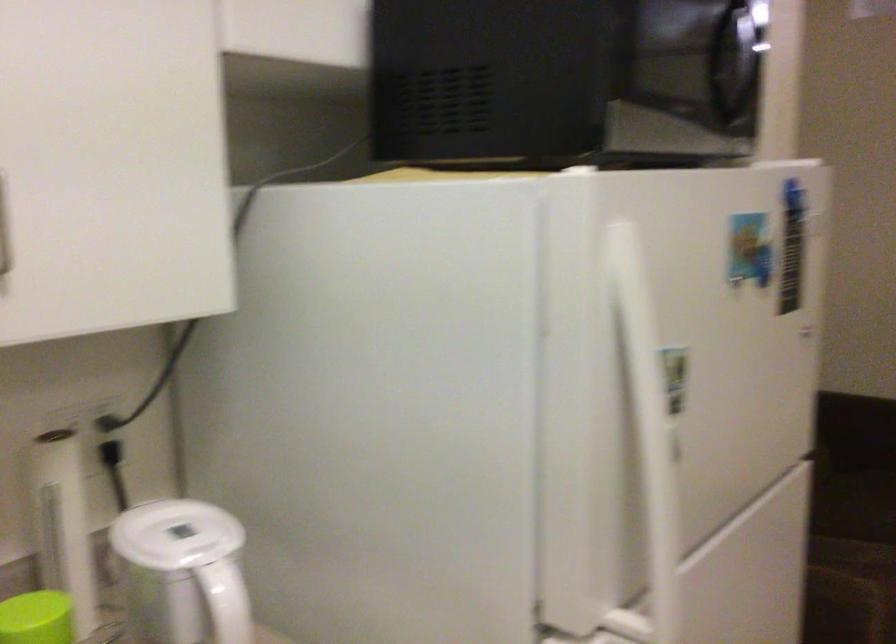
Image resolution: width=896 pixels, height=644 pixels. I want to click on white kettle lid, so click(x=176, y=534).